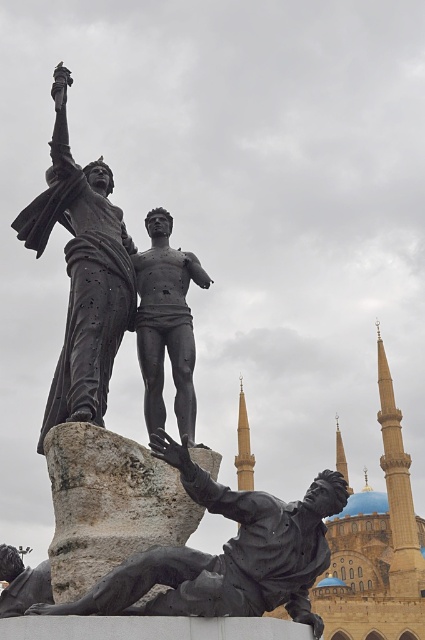
Is bronze statue at upper left positioned in front of black polished statue at center?

No, it is not.

What do you see at coordinates (82, 273) in the screenshot?
I see `bronze statue at upper left` at bounding box center [82, 273].

Image resolution: width=425 pixels, height=640 pixels. I want to click on bronze statue at upper left, so click(82, 273).

Can you confirm if bronze statue at lower center is positioned to the left of black polished statue at center?

Incorrect, bronze statue at lower center is not on the left side of black polished statue at center.

Is bronze statue at lower center taller than black polished statue at center?

Incorrect, bronze statue at lower center's height is not larger of black polished statue at center's.

Locate an element on the screen. This screenshot has height=640, width=425. bronze statue at lower center is located at coordinates (224, 554).

Does gray stone statue at center have a larger size compared to black polished statue at center?

Incorrect, gray stone statue at center is not larger than black polished statue at center.

Is the position of gray stone statue at center more distant than that of black polished statue at center?

That is True.

In order to click on gray stone statue at center in this screenshot , I will do `click(108, 504)`.